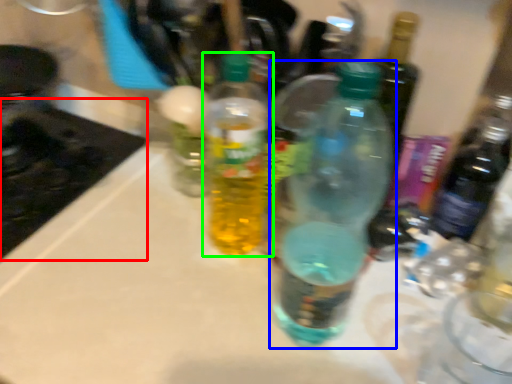
Question: Considering the real-world distances, which object is farthest from appliance (highlighted by a red box)? bottle (highlighted by a blue box) or bottle (highlighted by a green box)?

Choices:
 (A) bottle
 (B) bottle

Answer: (A)